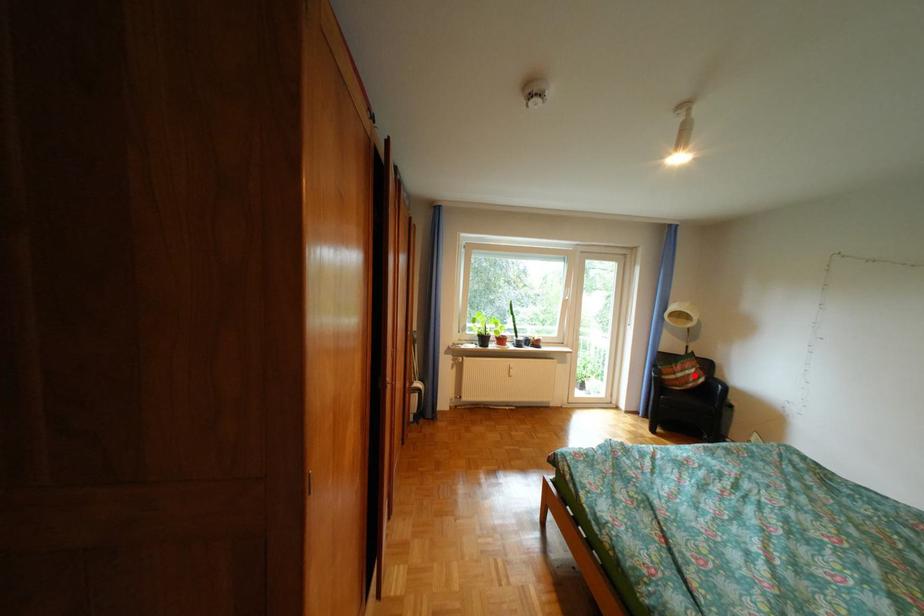
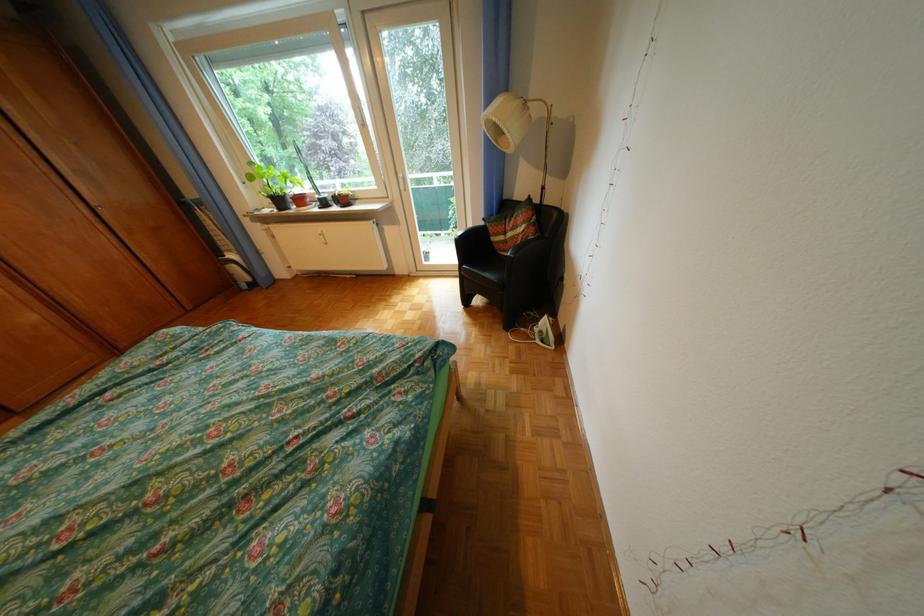
Where in the second image is the point corresponding to the highlighted location from the first image?

(524, 236)